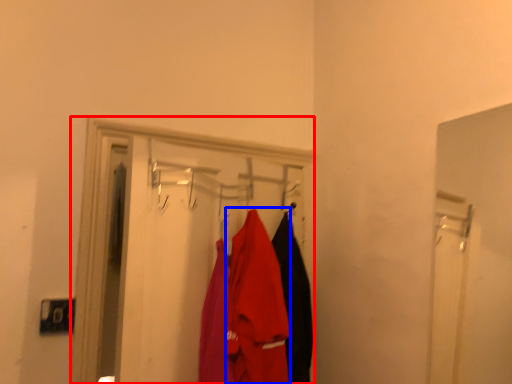
Question: Which point is closer to the camera, closet (highlighted by a red box) or clothing (highlighted by a blue box)?

Choices:
 (A) closet
 (B) clothing

Answer: (A)